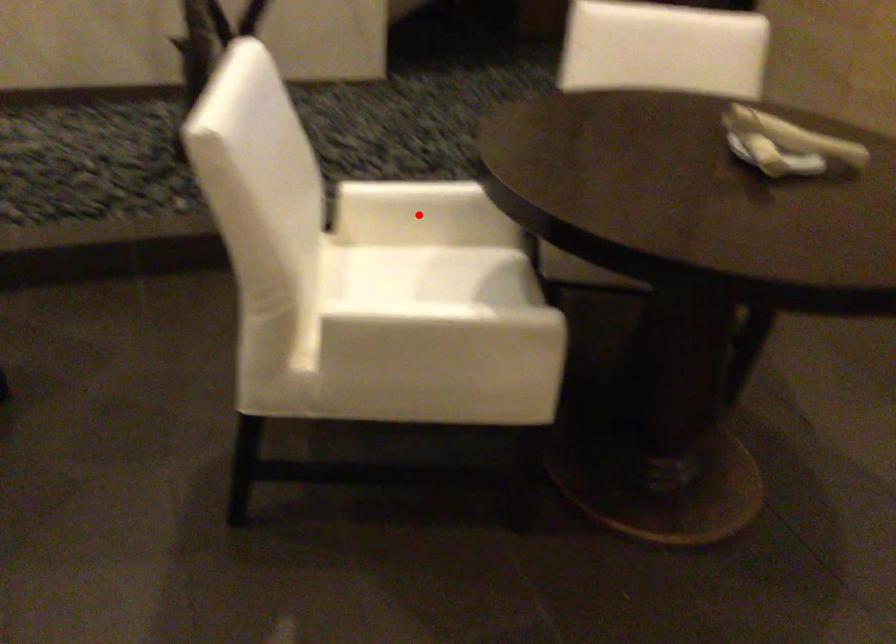
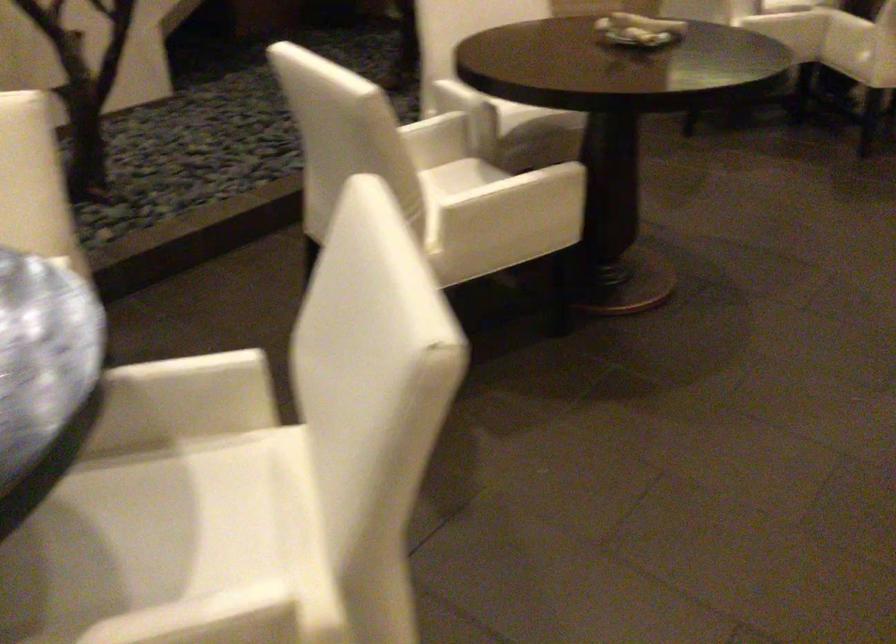
Question: I am providing you with two images of the same scene from different viewpoints. A red point is marked on the first image. Is the red point's position out of view in image 2?

Choices:
 (A) Yes
 (B) No

Answer: (A)